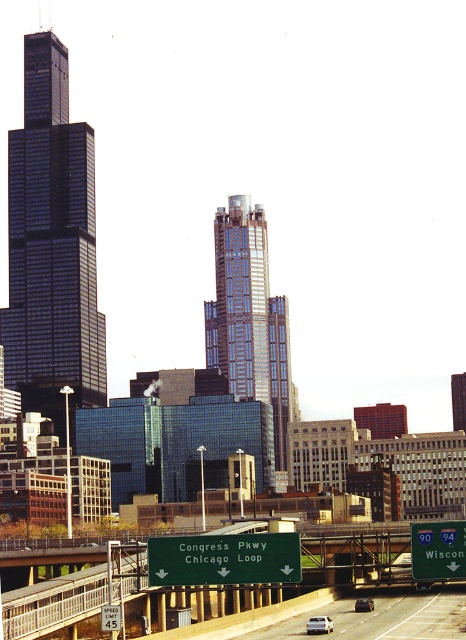
What is located at the point with coordinates (224, 557)?

The green matte street sign at center is located at point (224, 557).